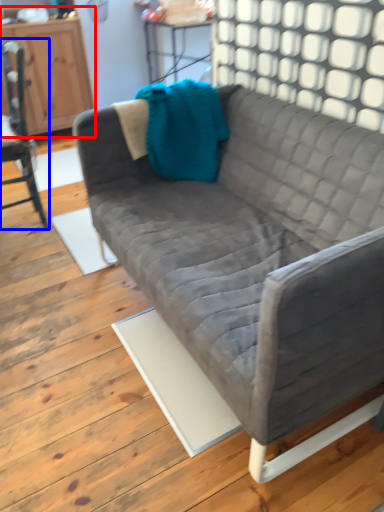
Question: Which object appears closest to the camera in this image, dresser (highlighted by a red box) or chair (highlighted by a blue box)?

Choices:
 (A) dresser
 (B) chair

Answer: (B)